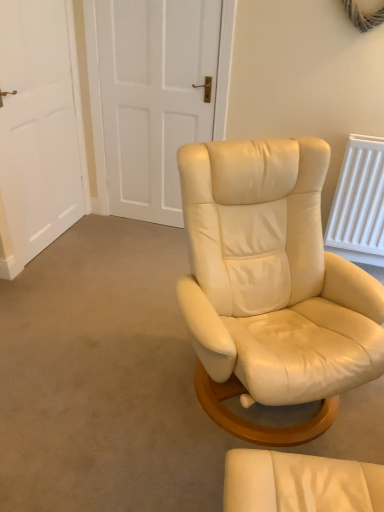
I want to click on vacant space that's between white matte door at upper left, acting as the second door starting from the right, and white matte door at upper center, acting as the 2th door starting from the left, so [115, 240].